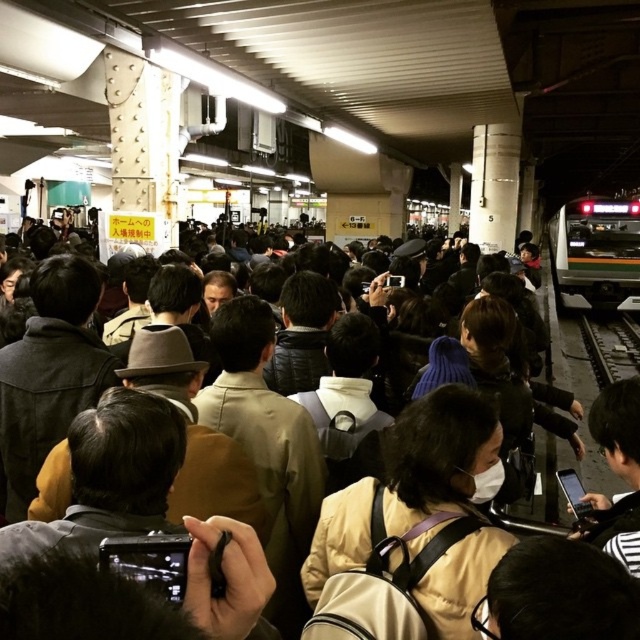
Question: Does beige fabric backpack at center have a greater width compared to green matte train at right?

Choices:
 (A) yes
 (B) no

Answer: (B)

Question: Which point is closer to the camera?

Choices:
 (A) (564, 291)
 (B) (428, 513)

Answer: (B)

Question: Can you confirm if beige fabric backpack at center is positioned to the right of green matte train at right?

Choices:
 (A) yes
 (B) no

Answer: (B)

Question: Estimate the real-world distances between objects in this image. Which object is farther from the green matte train at right?

Choices:
 (A) beige fabric backpack at center
 (B) black metal train track at right

Answer: (A)

Question: Which object appears farthest from the camera in this image?

Choices:
 (A) black metal train track at right
 (B) beige fabric backpack at center
 (C) green matte train at right

Answer: (C)

Question: Can you confirm if beige fabric backpack at center is wider than green matte train at right?

Choices:
 (A) no
 (B) yes

Answer: (A)